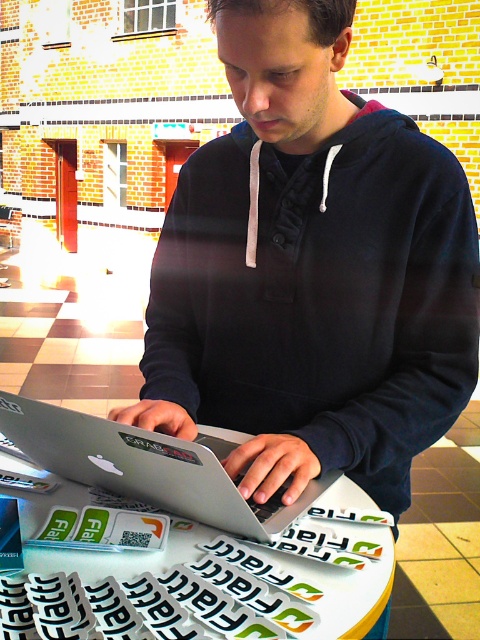
Question: Does black cotton sweatshirt at center appear under silver metallic laptop at center?

Choices:
 (A) no
 (B) yes

Answer: (A)

Question: Can you confirm if black cotton sweatshirt at center is wider than silver metallic laptop at center?

Choices:
 (A) no
 (B) yes

Answer: (B)

Question: Can you confirm if black cotton sweatshirt at center is wider than silver metallic laptop at center?

Choices:
 (A) no
 (B) yes

Answer: (B)

Question: Which object appears closest to the camera in this image?

Choices:
 (A) black cotton sweatshirt at center
 (B) silver metallic laptop at center

Answer: (B)

Question: Which object is closer to the camera taking this photo?

Choices:
 (A) white glossy table at center
 (B) black cotton sweatshirt at center
 (C) silver metallic laptop at center

Answer: (A)

Question: Which point is farther to the camera?

Choices:
 (A) silver metallic laptop at center
 (B) black cotton sweatshirt at center

Answer: (B)